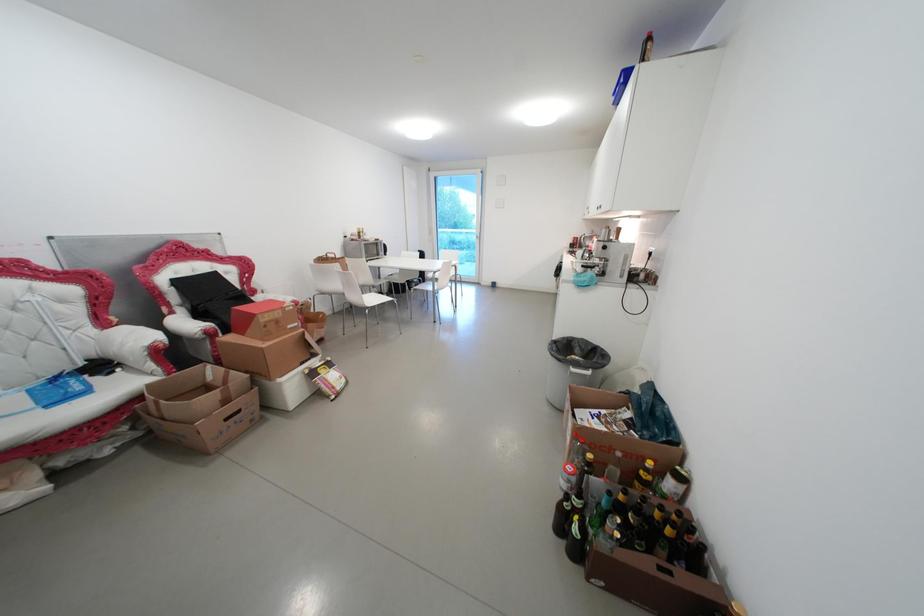
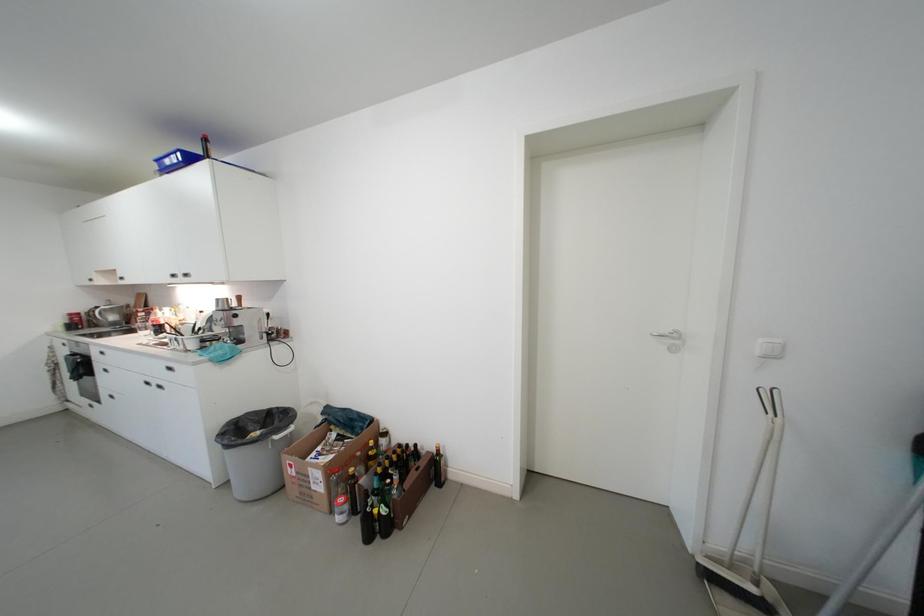
Question: The camera is either moving clockwise (left) or counter-clockwise (right) around the object. The first image is from the beginning of the video and the second image is from the end. Is the camera moving left or right when shooting the video?

Choices:
 (A) Left
 (B) Right

Answer: (A)